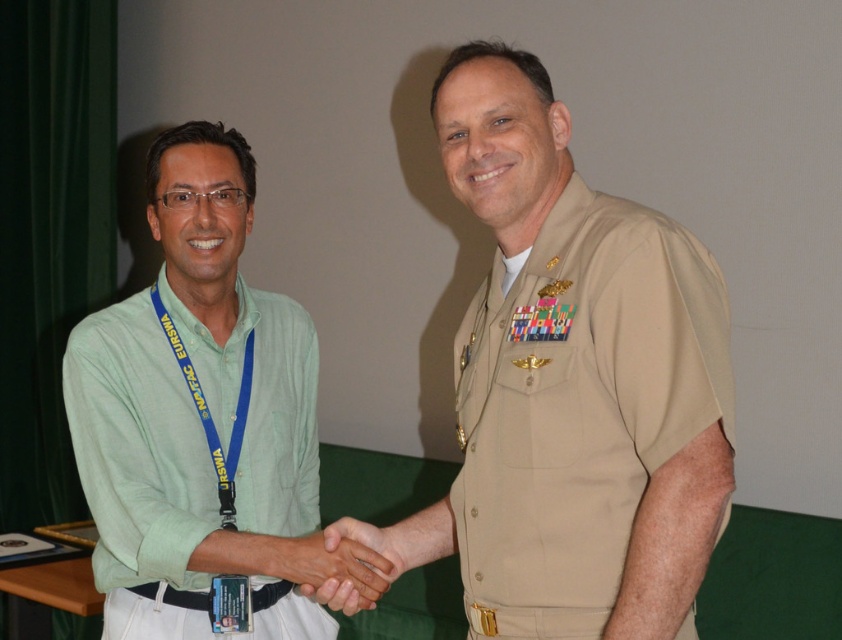
Question: Which object appears farthest from the camera in this image?

Choices:
 (A) blue fabric lanyard at left
 (B) smooth skin handshake at center

Answer: (A)

Question: Does green cotton shirt at left have a greater width compared to smooth skin handshake at center?

Choices:
 (A) no
 (B) yes

Answer: (B)

Question: Which point appears farthest from the camera in this image?

Choices:
 (A) (374, 572)
 (B) (721, 321)
 (C) (240, 420)

Answer: (C)

Question: Does green cotton shirt at left appear on the right side of blue fabric lanyard at left?

Choices:
 (A) no
 (B) yes

Answer: (A)

Question: Can you confirm if green cotton shirt at left is wider than blue fabric lanyard at left?

Choices:
 (A) yes
 (B) no

Answer: (A)

Question: Among these objects, which one is nearest to the camera?

Choices:
 (A) smooth skin handshake at center
 (B) tan uniform at center

Answer: (B)